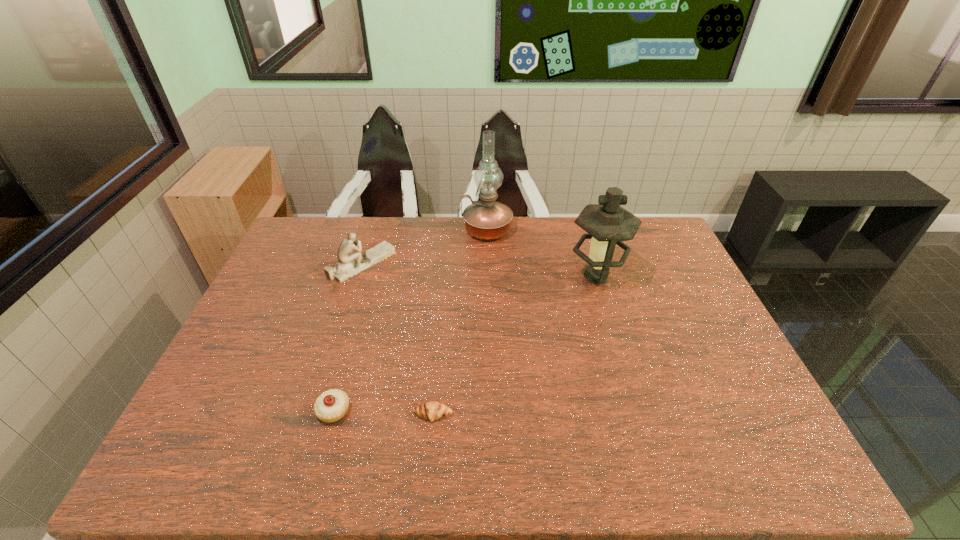
I want to click on free location at the far left corner, so click(309, 227).

The width and height of the screenshot is (960, 540). Find the location of `free space at the far right corner`. free space at the far right corner is located at coordinates (636, 255).

The image size is (960, 540). Identify the location of free spot between the second tallest object and the tallest object. (541, 253).

In order to click on free space between the shortest object and the taller oil lamp in this screenshot , I will do `click(460, 322)`.

Locate an element on the screen. free spot between the nearer oil lamp and the tallest object is located at coordinates (541, 253).

Find the location of a particular element. The height and width of the screenshot is (540, 960). vacant area that lies between the nearer oil lamp and the third tallest object is located at coordinates (479, 270).

Find the location of a particular element. Image resolution: width=960 pixels, height=540 pixels. vacant area between the figurine and the rightmost object is located at coordinates (479, 270).

Image resolution: width=960 pixels, height=540 pixels. In order to click on free space that is in between the farthest object and the figurine in this screenshot , I will do (424, 247).

The image size is (960, 540). I want to click on blank region between the rightmost object and the second shortest object, so click(x=465, y=343).

At what (x,y) coordinates should I click in order to perform the action: click on free spot between the shortest object and the farther oil lamp. Please return your answer as a coordinate pair (x, y). Looking at the image, I should click on (460, 322).